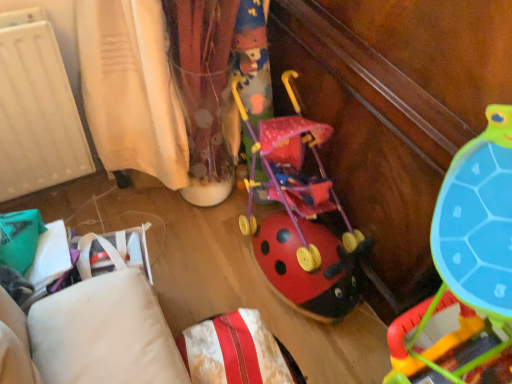
Find the location of a particular element. This screenshot has height=384, width=512. free spot above velvety white pillow at lower center (from a real-world perspective) is located at coordinates (232, 352).